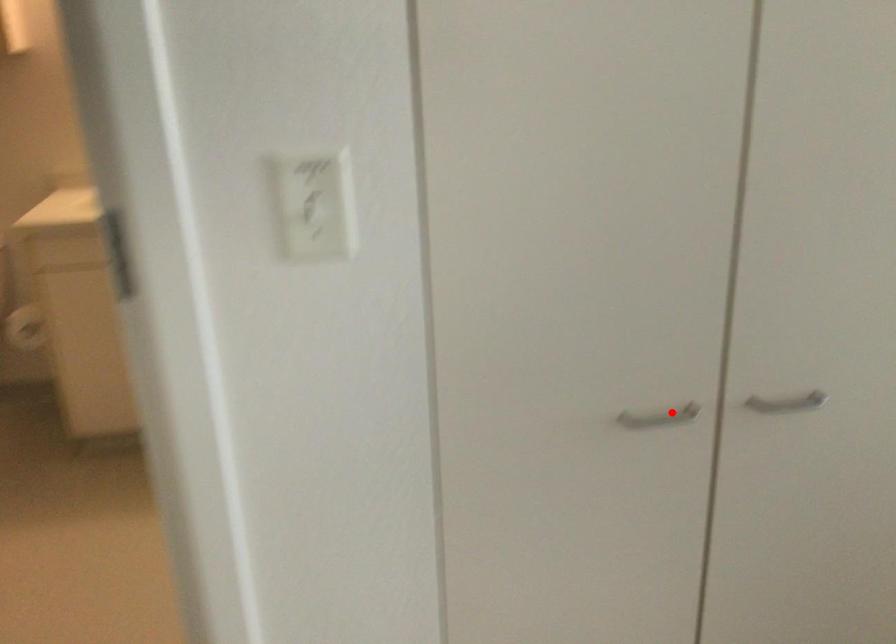
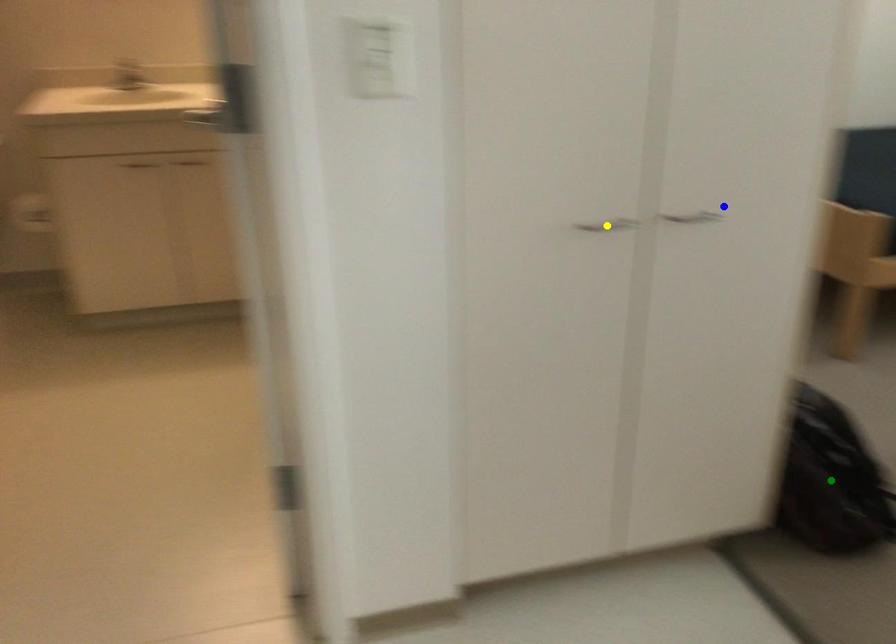
Question: I am providing you with two images of the same scene from different viewpoints. A red point is marked on the first image. You are given multiple points on the second image. Can you choose the point in image 2 that corresponds to the point in image 1?

Choices:
 (A) blue point
 (B) yellow point
 (C) green point

Answer: (B)